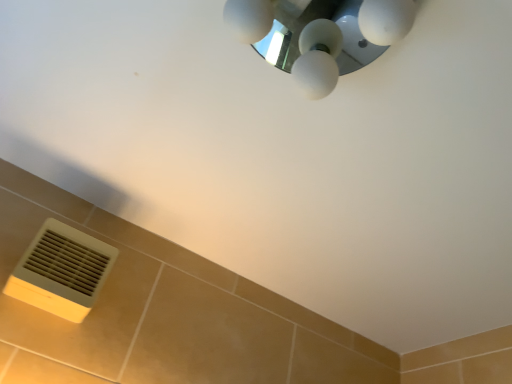
Question: Is white glossy light fixture at upper center in front of or behind beige plastic air conditioning at lower left in the image?

Choices:
 (A) front
 (B) behind

Answer: (A)

Question: In terms of height, does white glossy light fixture at upper center look taller or shorter compared to beige plastic air conditioning at lower left?

Choices:
 (A) short
 (B) tall

Answer: (A)

Question: Based on their positions, is white glossy light fixture at upper center located to the left or right of beige plastic air conditioning at lower left?

Choices:
 (A) left
 (B) right

Answer: (B)

Question: From the image's perspective, is beige plastic air conditioning at lower left located above or below white glossy light fixture at upper center?

Choices:
 (A) above
 (B) below

Answer: (B)

Question: Do you think beige plastic air conditioning at lower left is within white glossy light fixture at upper center, or outside of it?

Choices:
 (A) inside
 (B) outside

Answer: (B)

Question: Is beige plastic air conditioning at lower left bigger or smaller than white glossy light fixture at upper center?

Choices:
 (A) big
 (B) small

Answer: (B)

Question: From a real-world perspective, relative to white glossy light fixture at upper center, is beige plastic air conditioning at lower left vertically above or below?

Choices:
 (A) below
 (B) above

Answer: (A)